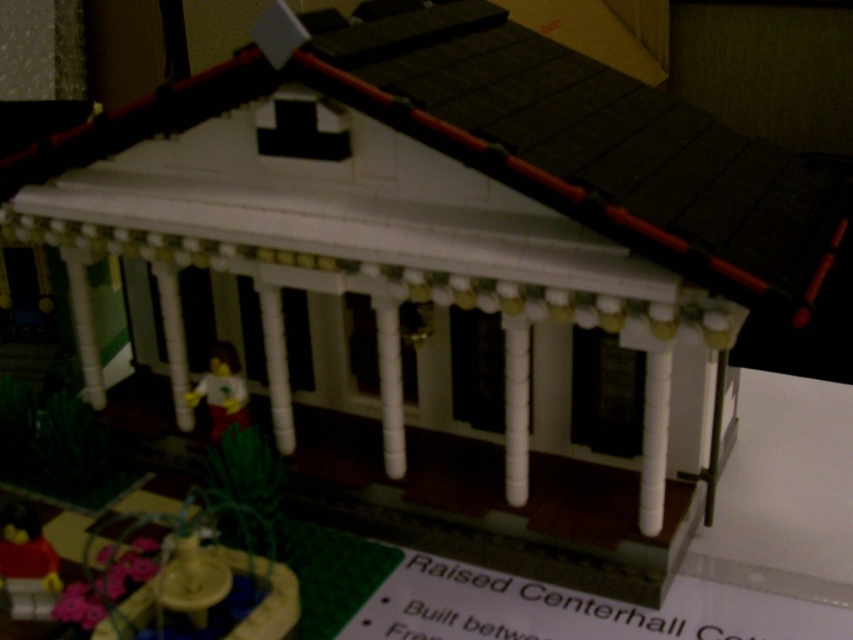
You are a visitor to this miniature LEGO scene and want to take a photo of the red plastic figure at lower left and the smooth yellow figure at center. From which direction should you stand to ensure both figures are visible in the frame without one blocking the other?

The red plastic figure at lower left is below the smooth yellow figure at center, so standing behind the smooth yellow figure at center would allow you to see both figures without obstruction.

You are a visitor approaching the Raised Centerhall Cottage model. You see the red plastic figure at lower left and the smooth yellow figure at center. Which figure is closer to the entrance of the cottage?

The red plastic figure at lower left is closer to the entrance of the cottage because it is positioned in front of the smooth yellow figure at center, indicating it is nearer to the front of the building.